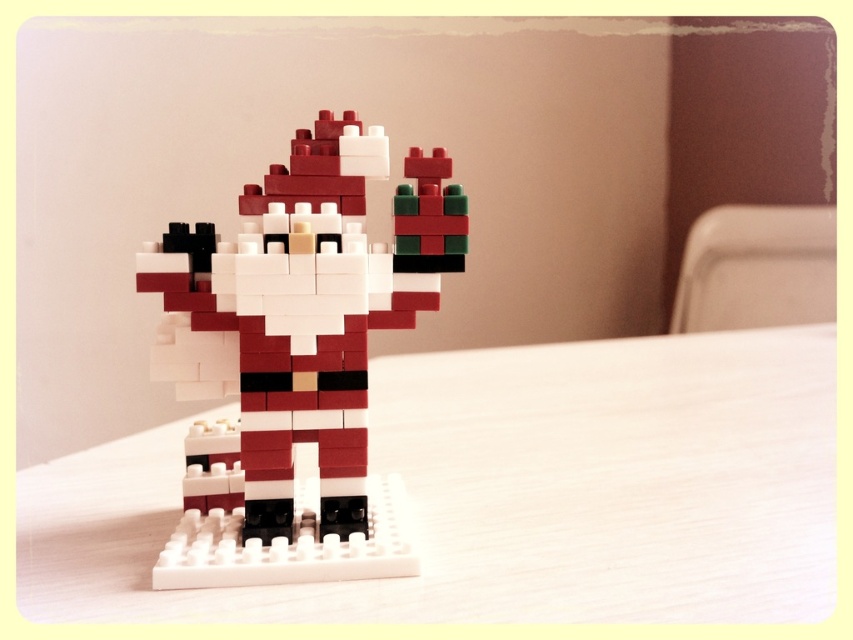
Looking at this image, you are setting up a holiday display and want to place a small gift box on the white matte table at center so that it is directly under the matte plastic santa at center. Is this possible given their positions?

The white matte table at center is below the matte plastic santa at center, so placing the gift box there would position it directly under the santa.

You are organizing a holiday display and have a small Santa figurine to place on a table. Given that the white matte table at center is larger than the matte plastic santa at center, will the Santa fit comfortably on the table without hanging over the edges?

The white matte table at center is larger in size than the matte plastic santa at center, so the Santa will fit comfortably on the table without hanging over the edges.

You are a photographer setting up a shot of the LEGO figure. The camera is positioned to capture the figure on the white matte table at center. If the table is 31.44 inches away from the camera, will the entire LEGO figure fit in the frame if the camera has a 50mm lens with a 46.5mm image sensor diagonal?

The white matte table at center is 31.44 inches away from the camera. With a 50mm lens and a 46.5mm image sensor diagonal, the camera can capture a field of view that should include the entire LEGO figure on the table at that distance.